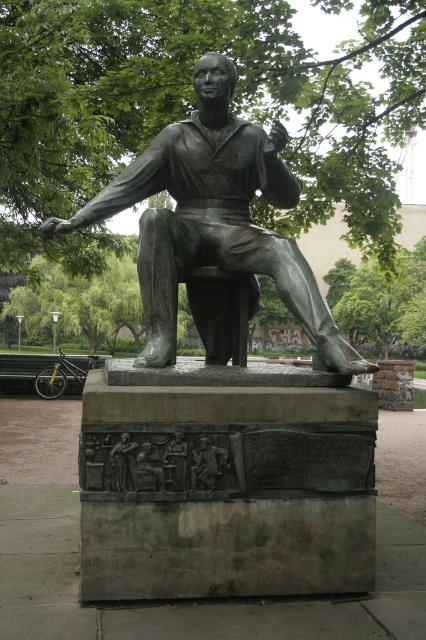
You are standing at the camera position and want to place a 2.5 meter long banner in front of the statue. The banner must be placed such that it is exactly halfway between the camera and the point marked as point (201, 445). Is this possible?

The distance between the camera and point (201, 445) is 4.53 meters. Half of this distance is 2.265 meters. Since the banner is 2.5 meters long, placing it exactly halfway would require the banner to extend beyond the halfway point, making it impossible to fit within the available space. Therefore, it is not possible.

You are a park visitor who wants to take a photo of the bronze statue at center without the bronze relief figure at center appearing in the background. Is this possible given their positions?

The bronze relief figure at center is behind the bronze statue at center, so if you position yourself so that the bronze statue at center is between you and the bronze relief figure at center, you can take a photo of the bronze statue at center without the bronze relief figure at center in the background.

You are standing 18.03 feet away from the point at coordinates (215, 225) in the image. If you want to take a photo of the statue from this position, will you be able to capture the entire statue in the frame without moving closer or farther away?

Yes, because the distance of 18.03 feet is sufficient to capture the entire statue in the frame from that position.